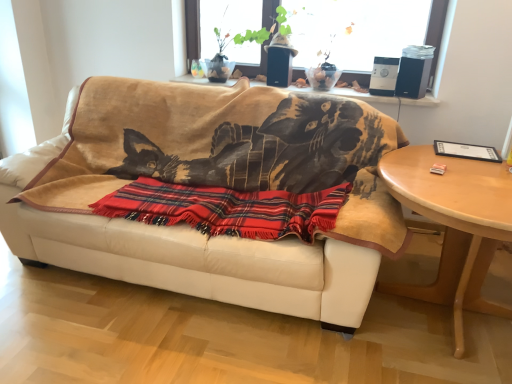
Question: Considering the relative sizes of light wood/finished table at right and white leather couch at center in the image provided, is light wood/finished table at right bigger than white leather couch at center?

Choices:
 (A) no
 (B) yes

Answer: (A)

Question: Does light wood/finished table at right contain white leather couch at center?

Choices:
 (A) no
 (B) yes

Answer: (A)

Question: Considering the relative positions of light wood/finished table at right and white leather couch at center in the image provided, is light wood/finished table at right to the left of white leather couch at center from the viewer's perspective?

Choices:
 (A) yes
 (B) no

Answer: (B)

Question: From the image's perspective, is light wood/finished table at right over white leather couch at center?

Choices:
 (A) no
 (B) yes

Answer: (A)

Question: Is light wood/finished table at right at the right side of white leather couch at center?

Choices:
 (A) yes
 (B) no

Answer: (A)

Question: Is transparent glass window at upper center wider or thinner than light wood/finished table at right?

Choices:
 (A) thin
 (B) wide

Answer: (A)

Question: From a real-world perspective, is transparent glass window at upper center physically located above or below light wood/finished table at right?

Choices:
 (A) below
 (B) above

Answer: (B)

Question: Considering their positions, is transparent glass window at upper center located in front of or behind light wood/finished table at right?

Choices:
 (A) front
 (B) behind

Answer: (B)

Question: From their relative heights in the image, would you say transparent glass window at upper center is taller or shorter than light wood/finished table at right?

Choices:
 (A) tall
 (B) short

Answer: (B)

Question: Considering the positions of point (52, 221) and point (269, 3), is point (52, 221) closer or farther from the camera than point (269, 3)?

Choices:
 (A) farther
 (B) closer

Answer: (B)

Question: Based on their positions, is white leather couch at center located to the left or right of transparent glass window at upper center?

Choices:
 (A) left
 (B) right

Answer: (A)

Question: Considering the positions of white leather couch at center and transparent glass window at upper center in the image, is white leather couch at center wider or thinner than transparent glass window at upper center?

Choices:
 (A) thin
 (B) wide

Answer: (B)

Question: Based on their sizes in the image, would you say white leather couch at center is bigger or smaller than transparent glass window at upper center?

Choices:
 (A) small
 (B) big

Answer: (B)

Question: Do you think light wood/finished table at right is within transparent glass window at upper center, or outside of it?

Choices:
 (A) inside
 (B) outside

Answer: (B)

Question: Considering the positions of point (407, 165) and point (435, 0), is point (407, 165) closer or farther from the camera than point (435, 0)?

Choices:
 (A) closer
 (B) farther

Answer: (A)